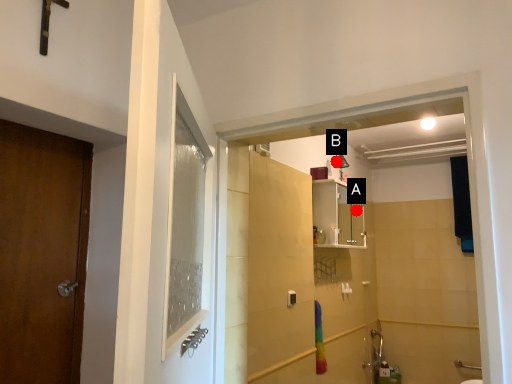
Question: Two points are circled on the image, labeled by A and B beside each circle. Which point appears farthest from the camera in this image?

Choices:
 (A) A is further
 (B) B is further

Answer: (A)